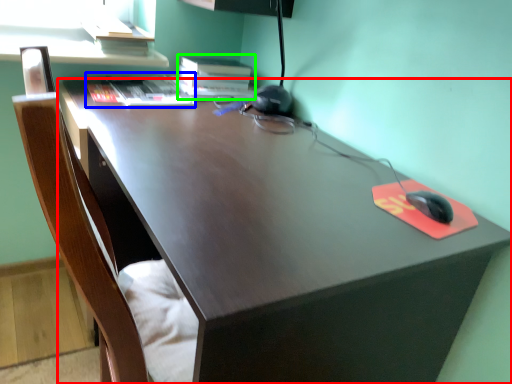
Question: Which object is the closest to the desk (highlighted by a red box)? Choose among these: book (highlighted by a blue box) or book (highlighted by a green box).

Choices:
 (A) book
 (B) book

Answer: (A)